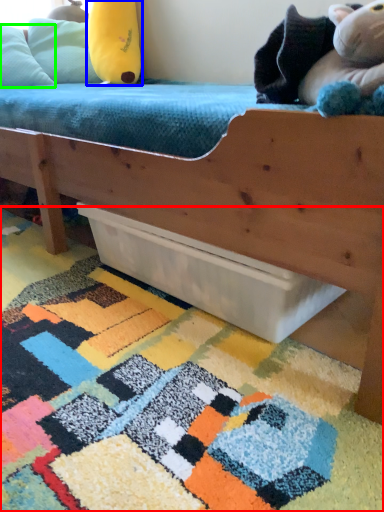
Question: Which object is the closest to the mat (highlighted by a red box)? Choose among these: toy (highlighted by a blue box) or pillow (highlighted by a green box).

Choices:
 (A) toy
 (B) pillow

Answer: (B)